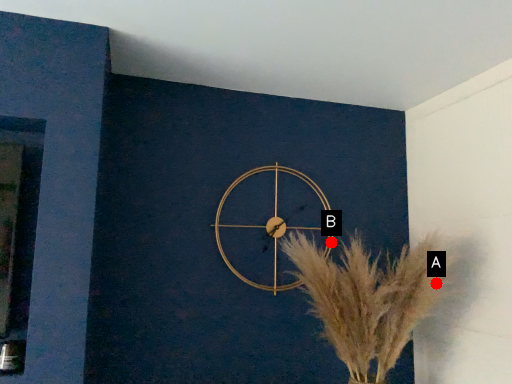
Question: Two points are circled on the image, labeled by A and B beside each circle. Which point is closer to the camera taking this photo?

Choices:
 (A) A is closer
 (B) B is closer

Answer: (A)